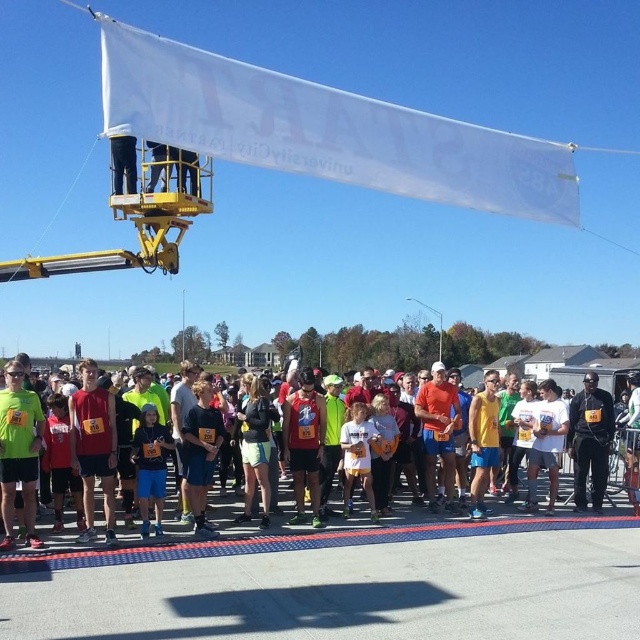
Question: Which object is farther from the camera taking this photo?

Choices:
 (A) black matte pants at center
 (B) matte black shirt at center

Answer: (A)

Question: Does matte black shirt at center appear over black matte pants at center?

Choices:
 (A) yes
 (B) no

Answer: (B)

Question: Which point appears farthest from the camera in this image?

Choices:
 (A) (385, 524)
 (B) (579, 502)

Answer: (B)

Question: Which of the following is the farthest from the observer?

Choices:
 (A) (596, 477)
 (B) (352, 444)

Answer: (A)

Question: Can you confirm if matte black shirt at center is positioned to the left of black matte pants at center?

Choices:
 (A) no
 (B) yes

Answer: (B)

Question: Can you confirm if matte black shirt at center is bigger than black matte pants at center?

Choices:
 (A) yes
 (B) no

Answer: (A)